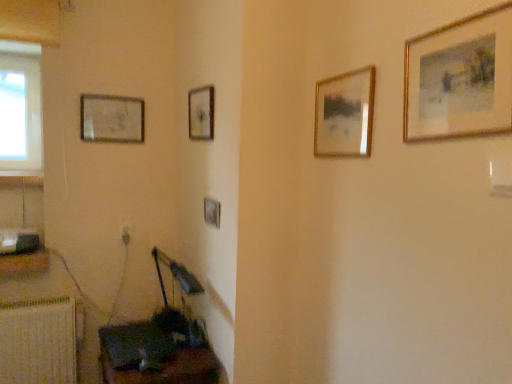
Question: From a real-world perspective, is gold-framed painting at upper right, the first picture frame in the right-to-left sequence, positioned under wooden dark brown table at lower left based on gravity?

Choices:
 (A) yes
 (B) no

Answer: (B)

Question: Would you consider gold-framed painting at upper right, the first picture frame in the right-to-left sequence, to be distant from wooden dark brown table at lower left?

Choices:
 (A) no
 (B) yes

Answer: (B)

Question: From the image's perspective, is gold-framed painting at upper right, the first picture frame in the right-to-left sequence, located beneath wooden dark brown table at lower left?

Choices:
 (A) yes
 (B) no

Answer: (B)

Question: Considering the relative positions of gold-framed painting at upper right, marked as the fifth picture frame in a left-to-right arrangement, and wooden dark brown table at lower left in the image provided, is gold-framed painting at upper right, marked as the fifth picture frame in a left-to-right arrangement, in front of wooden dark brown table at lower left?

Choices:
 (A) yes
 (B) no

Answer: (A)

Question: Is gold-framed painting at upper right, which is counted as the first picture frame, starting from the front, aimed at wooden dark brown table at lower left?

Choices:
 (A) no
 (B) yes

Answer: (A)

Question: In terms of height, does wooden frame at center, the fourth picture frame positioned from the front, look taller or shorter compared to wooden picture frame at lower left, the 3th picture frame positioned from the left?

Choices:
 (A) tall
 (B) short

Answer: (A)

Question: Is wooden frame at center, marked as the 4th picture frame in a right-to-left arrangement, inside or outside of wooden picture frame at lower left, the 3th picture frame positioned from the left?

Choices:
 (A) outside
 (B) inside

Answer: (A)

Question: In terms of width, does wooden frame at center, marked as the 4th picture frame in a right-to-left arrangement, look wider or thinner when compared to wooden picture frame at lower left, acting as the third picture frame starting from the front?

Choices:
 (A) thin
 (B) wide

Answer: (B)

Question: From a real-world perspective, is wooden frame at center, the fourth picture frame positioned from the front, above or below wooden picture frame at lower left, the 3th picture frame when ordered from right to left?

Choices:
 (A) below
 (B) above

Answer: (B)

Question: In the image, is wooden frame painting at center, arranged as the 2th picture frame when viewed from the front, positioned in front of or behind gold-framed painting at upper right, the fifth picture frame viewed from the back?

Choices:
 (A) behind
 (B) front

Answer: (A)

Question: Looking at their shapes, would you say wooden frame painting at center, arranged as the fourth picture frame when viewed from the left, is wider or thinner than gold-framed painting at upper right, which is counted as the first picture frame, starting from the front?

Choices:
 (A) thin
 (B) wide

Answer: (B)

Question: In the image, is wooden frame painting at center, arranged as the 2th picture frame when viewed from the front, on the left side or the right side of gold-framed painting at upper right, marked as the fifth picture frame in a left-to-right arrangement?

Choices:
 (A) right
 (B) left

Answer: (B)

Question: From a real-world perspective, relative to gold-framed painting at upper right, the first picture frame in the right-to-left sequence, is wooden frame painting at center, the 2th picture frame in the right-to-left sequence, vertically above or below?

Choices:
 (A) below
 (B) above

Answer: (A)

Question: Considering their positions, is wooden radiator at lower left located in front of or behind wooden frame painting at center, arranged as the fourth picture frame when viewed from the left?

Choices:
 (A) front
 (B) behind

Answer: (B)

Question: Considering the positions of wooden radiator at lower left and wooden frame painting at center, which is counted as the 4th picture frame, starting from the back, in the image, is wooden radiator at lower left taller or shorter than wooden frame painting at center, which is counted as the 4th picture frame, starting from the back,?

Choices:
 (A) tall
 (B) short

Answer: (A)